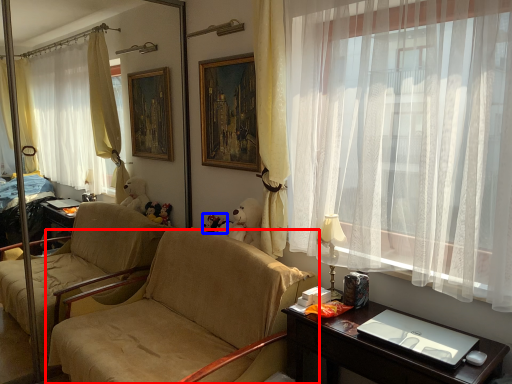
Question: Which of the following is the closest to the observer, chair (highlighted by a red box) or toy (highlighted by a blue box)?

Choices:
 (A) chair
 (B) toy

Answer: (A)